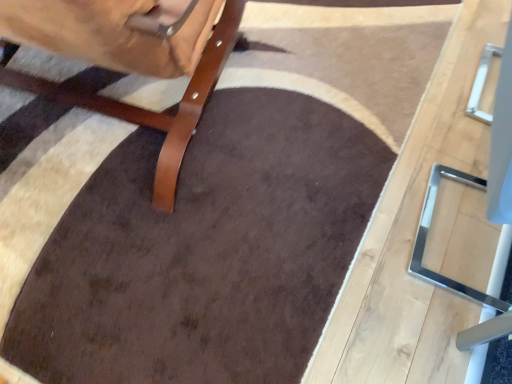
In order to face metallic silver table at right, should I rotate leftwards or rightwards?

It's best to rotate right around 30.779 degrees.

Locate an element on the screen. metallic silver table at right is located at coordinates (414, 234).

What do you see at coordinates (414, 234) in the screenshot? The image size is (512, 384). I see `metallic silver table at right` at bounding box center [414, 234].

This screenshot has width=512, height=384. What do you see at coordinates (151, 111) in the screenshot? I see `brown leather chair at left` at bounding box center [151, 111].

Identify the location of brown leather chair at left. This screenshot has height=384, width=512. (151, 111).

What is the approximate width of brown leather chair at left?

It is 33.86 inches.

Measure the distance between brown leather chair at left and camera.

1.11 meters.

Locate an element on the screen. metallic silver table at right is located at coordinates (414, 234).

Is metallic silver table at right to the right of brown leather chair at left from the viewer's perspective?

Yes, metallic silver table at right is to the right of brown leather chair at left.

In the image, is metallic silver table at right positioned in front of or behind brown leather chair at left?

metallic silver table at right is positioned closer to the viewer than brown leather chair at left.

Considering the points (408, 155) and (201, 66), which point is behind, point (408, 155) or point (201, 66)?

The point (408, 155) is farther from the camera.

From the image's perspective, would you say metallic silver table at right is shown under brown leather chair at left?

Yes, from the image's perspective, metallic silver table at right is beneath brown leather chair at left.

From a real-world perspective, who is located higher, metallic silver table at right or brown leather chair at left?

brown leather chair at left, from a real-world perspective.

Is metallic silver table at right wider or thinner than brown leather chair at left?

Clearly, metallic silver table at right has less width compared to brown leather chair at left.

Considering the relative sizes of metallic silver table at right and brown leather chair at left in the image provided, is metallic silver table at right taller than brown leather chair at left?

Yes.

Based on the photo, is metallic silver table at right bigger or smaller than brown leather chair at left?

Considering their sizes, metallic silver table at right takes up less space than brown leather chair at left.

Choose the correct answer: Is metallic silver table at right inside brown leather chair at left or outside it?

metallic silver table at right lies outside brown leather chair at left.

Would you consider metallic silver table at right to be distant from brown leather chair at left?

No, metallic silver table at right is not far from brown leather chair at left.

Is metallic silver table at right turned away from brown leather chair at left?

Yes, brown leather chair at left is at the back of metallic silver table at right.

How many degrees apart are the facing directions of metallic silver table at right and brown leather chair at left?

102 degrees.

The width and height of the screenshot is (512, 384). In order to click on furniture above the metallic silver table at right (from a real-world perspective) in this screenshot , I will do `click(151, 111)`.

Is brown leather chair at left to the left of metallic silver table at right from the viewer's perspective?

Correct, you'll find brown leather chair at left to the left of metallic silver table at right.

In the scene shown: Is brown leather chair at left in front of or behind metallic silver table at right in the image?

Clearly, brown leather chair at left is behind metallic silver table at right.

Is point (159, 181) closer to camera compared to point (448, 148)?

Yes, point (159, 181) is in front of point (448, 148).

From the image's perspective, which is above, brown leather chair at left or metallic silver table at right?

brown leather chair at left is shown above in the image.

From a real-world perspective, which is physically below, brown leather chair at left or metallic silver table at right?

metallic silver table at right is physically lower.

Can you confirm if brown leather chair at left is wider than metallic silver table at right?

Yes.

Considering the sizes of objects brown leather chair at left and metallic silver table at right in the image provided, who is taller, brown leather chair at left or metallic silver table at right?

With more height is metallic silver table at right.

Considering the relative sizes of brown leather chair at left and metallic silver table at right in the image provided, is brown leather chair at left bigger than metallic silver table at right?

Correct, brown leather chair at left is larger in size than metallic silver table at right.

Would you say brown leather chair at left is inside or outside metallic silver table at right?

brown leather chair at left is not inside metallic silver table at right, it's outside.

Is the surface of brown leather chair at left in direct contact with metallic silver table at right?

brown leather chair at left and metallic silver table at right are clearly separated.

Is metallic silver table at right at the back of brown leather chair at left?

brown leather chair at left is not turned away from metallic silver table at right.

How far apart are brown leather chair at left and metallic silver table at right?

brown leather chair at left and metallic silver table at right are 28.79 inches apart from each other.

Image resolution: width=512 pixels, height=384 pixels. What are the coordinates of `table lying on the right of brown leather chair at left` in the screenshot? It's located at (414, 234).

Identify the location of table that is on the right side of brown leather chair at left. (414, 234).

Where is `furniture that is on the left side of metallic silver table at right`? This screenshot has height=384, width=512. furniture that is on the left side of metallic silver table at right is located at coordinates click(x=151, y=111).